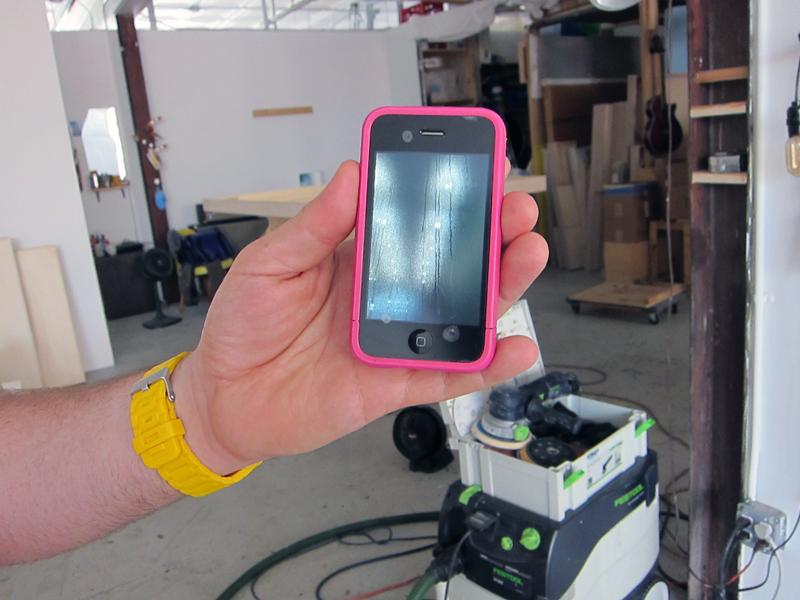
Image resolution: width=800 pixels, height=600 pixels. What are the coordinates of `plug` in the screenshot? It's located at (740, 525).